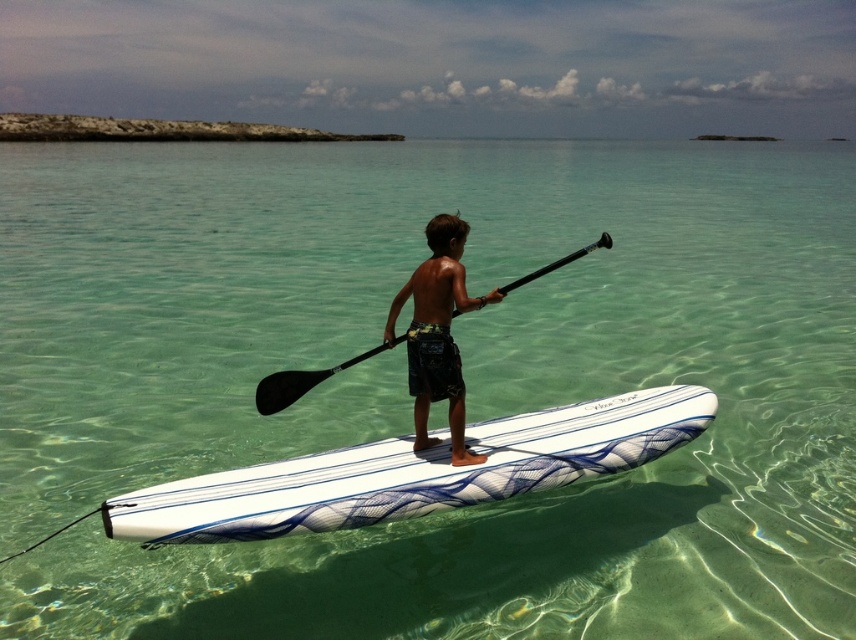
Question: Is dark brown textured shorts at center thinner than black matte paddle at center?

Choices:
 (A) no
 (B) yes

Answer: (A)

Question: Can you confirm if dark brown textured shorts at center is smaller than black matte paddle at center?

Choices:
 (A) yes
 (B) no

Answer: (B)

Question: Estimate the real-world distances between objects in this image. Which object is farther from the black matte paddle at center?

Choices:
 (A) white glossy surfboard at center
 (B) dark brown textured shorts at center

Answer: (A)

Question: Considering the real-world distances, which object is farthest from the dark brown textured shorts at center?

Choices:
 (A) black matte paddle at center
 (B) white glossy surfboard at center

Answer: (B)

Question: Which point is closer to the camera taking this photo?

Choices:
 (A) (632, 461)
 (B) (506, 289)

Answer: (B)

Question: Observing the image, what is the correct spatial positioning of white glossy surfboard at center in reference to dark brown textured shorts at center?

Choices:
 (A) left
 (B) right

Answer: (B)